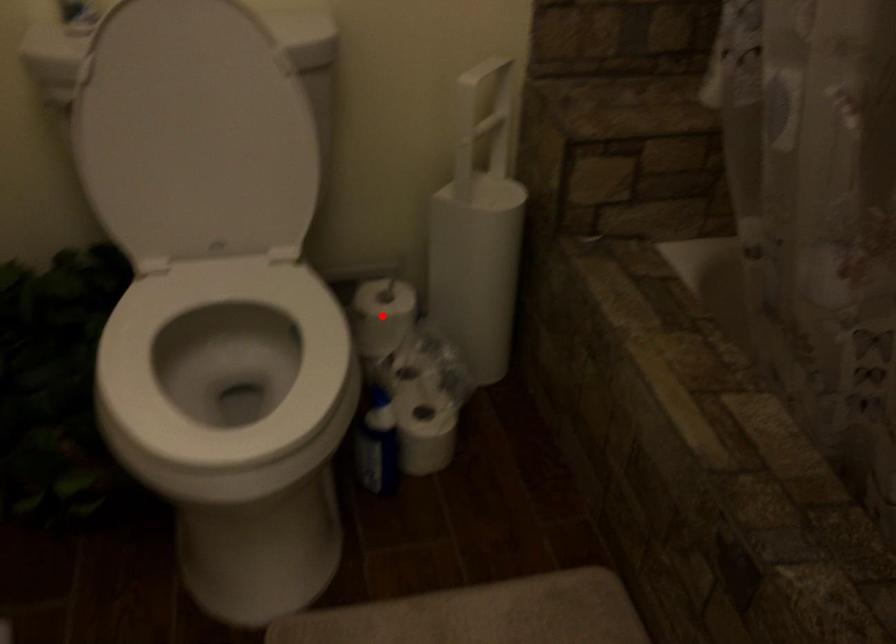
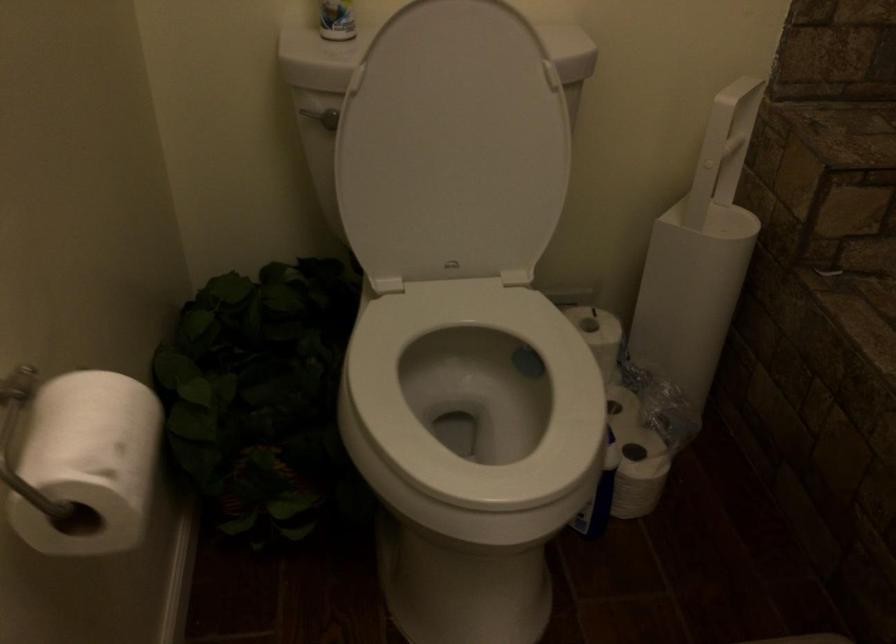
Question: I am providing you with two images of the same scene from different viewpoints. A red point is marked on the first image. At the location where the point appears in image 1, is it still visible in image 2?

Choices:
 (A) Yes
 (B) No

Answer: (B)